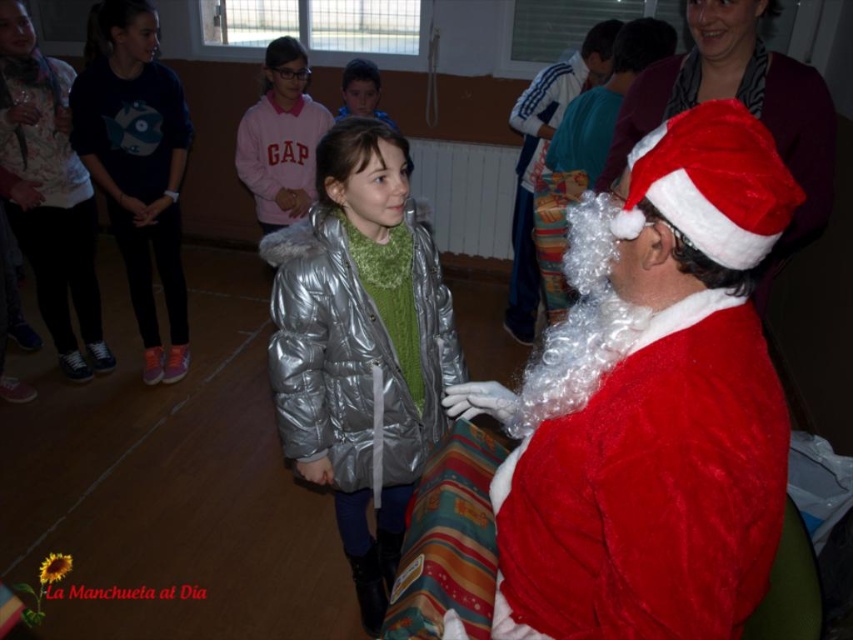
You are a photographer at the event and want to capture a photo of the shiny silver jacket at center and the pink fleece sweater at upper center. Which object should you focus on first if you want to ensure both are in frame without moving the camera?

The shiny silver jacket at center is wider than the pink fleece sweater at upper center. To ensure both are in frame without moving the camera, focus on the wider object first, which is the shiny silver jacket at center, then adjust to include the pink fleece sweater at upper center.

Looking at this image, you are a photographer setting up for a group photo. You need to position the velvet red santa claus at right and the pink fleece sweater at upper center so they are exactly 2 meters apart. Based on the current scene, is their current distance sufficient for your requirement?

The velvet red santa claus at right is currently 2.36 meters from the pink fleece sweater at upper center, which is more than the required 2 meters. To meet the exact requirement, you should move them closer by 0.36 meters.

You are a photographer at the event and want to take a photo of both the velvet red santa claus at right and the pink fleece sweater at upper center. Which object should you focus on first to ensure both are in clear focus?

You should focus on the velvet red santa claus at right first because it is closer to the viewer than the pink fleece sweater at upper center, so adjusting focus from near to far will help both be in clear focus.